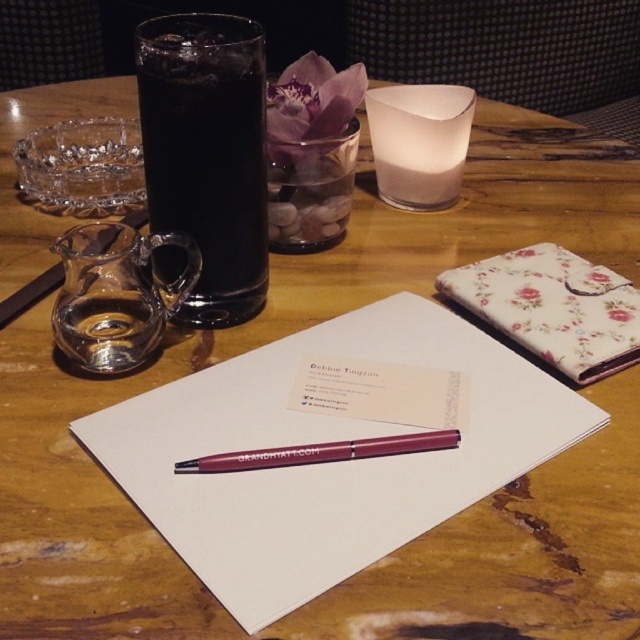
Between black glass at upper left and matte burgundy pen at center, which one appears on the left side from the viewer's perspective?

From the viewer's perspective, black glass at upper left appears more on the left side.

Based on the photo, between black glass at upper left and matte burgundy pen at center, which one appears on the right side from the viewer's perspective?

Positioned to the right is matte burgundy pen at center.

Does point (188, 97) lie behind point (301, 449)?

Yes, point (188, 97) is farther from viewer.

The height and width of the screenshot is (640, 640). Identify the location of black glass at upper left. (208, 154).

Between floral fabric wallet at center and white frosted glass candle at center, which one is positioned lower?

floral fabric wallet at center is below.

Is floral fabric wallet at center bigger than white frosted glass candle at center?

Yes, floral fabric wallet at center is bigger than white frosted glass candle at center.

Which is behind, point (604, 333) or point (442, 157)?

Positioned behind is point (442, 157).

Find the location of a particular element. floral fabric wallet at center is located at coordinates click(x=554, y=307).

Which is behind, point (202, 314) or point (396, 147)?

Positioned behind is point (396, 147).

Which is below, black glass at upper left or white frosted glass candle at center?

Positioned lower is black glass at upper left.

Is point (257, 177) positioned before point (451, 145)?

Yes.

Find the location of a particular element. The width and height of the screenshot is (640, 640). black glass at upper left is located at coordinates (208, 154).